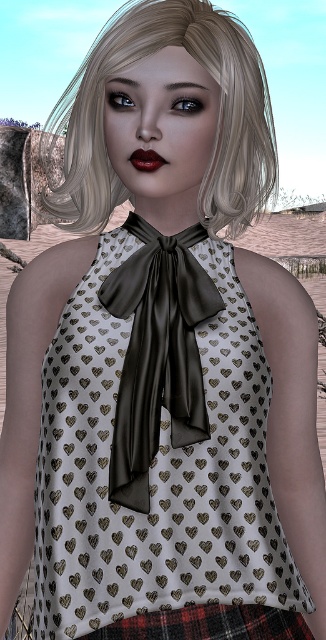
You are a photographer setting up for a photoshoot. You need to position a spotlight to the right of the red plaid skirt at lower center. Will the spotlight be to the left or right of the blonde silky hair at upper center?

The blonde silky hair at upper center is to the left of the red plaid skirt at lower center, so placing the spotlight to the right of the red plaid skirt at lower center would position it to the right of the blonde silky hair at upper center as well.

You are a fashion designer analyzing the outfit of a model in the image. The model is wearing a red plaid skirt at lower center and matte black lips at center. Which part of the outfit is positioned higher on the body?

The red plaid skirt at lower center is taller than matte black lips at center, so the skirt is positioned higher on the body.